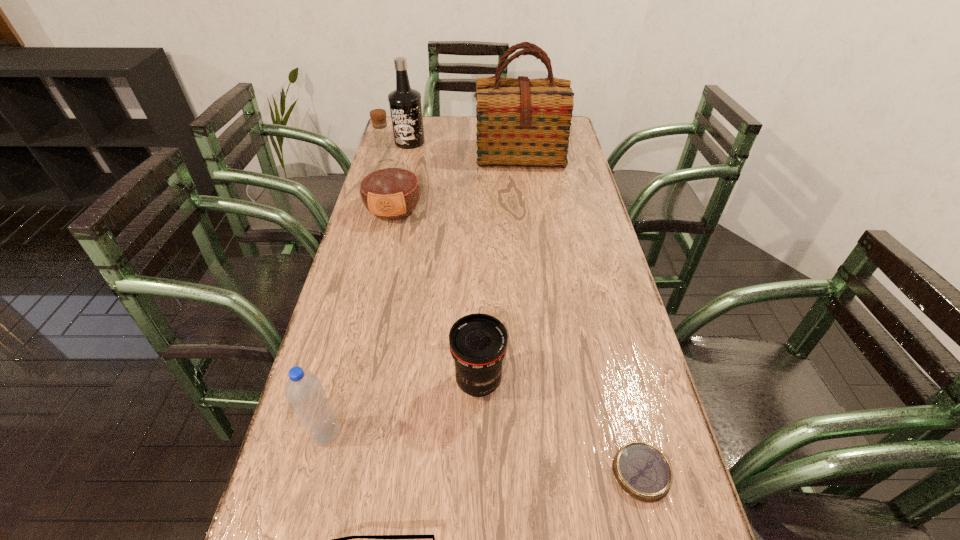
Locate an element on the screen. This screenshot has width=960, height=540. vacant area that lies between the compass and the fourth farthest object is located at coordinates (560, 427).

Image resolution: width=960 pixels, height=540 pixels. Identify the location of object that is the fourth closest one to the third shortest object. (390, 190).

At what (x,y) coordinates should I click in order to perform the action: click on object that can be found as the sixth closest to the fourth shortest object. Please return your answer as a coordinate pair (x, y). The height and width of the screenshot is (540, 960). Looking at the image, I should click on (405, 103).

The image size is (960, 540). Identify the location of vacant space that satisfies the following two spatial constraints: 1. on the front label of the farther liquor; 2. on the left side of the telephoto lens. (355, 381).

In order to click on vacant region that satisfies the following two spatial constraints: 1. on the front label of the nearer liquor; 2. on the left side of the shortest object in this screenshot , I will do `click(333, 472)`.

This screenshot has width=960, height=540. I want to click on vacant region that satisfies the following two spatial constraints: 1. on the front label of the farther liquor; 2. on the left side of the compass, so click(334, 472).